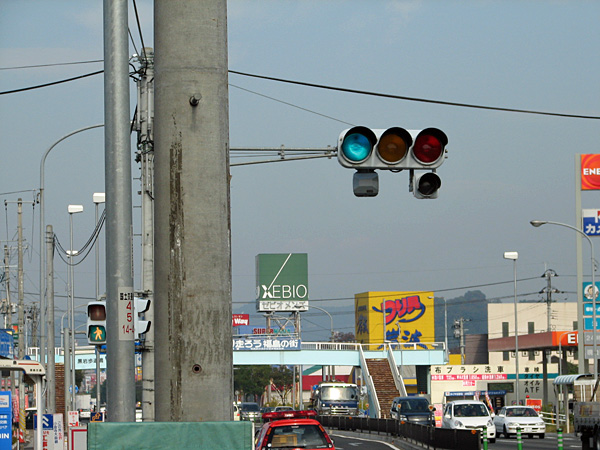
The width and height of the screenshot is (600, 450). I want to click on green light, so click(x=355, y=144).